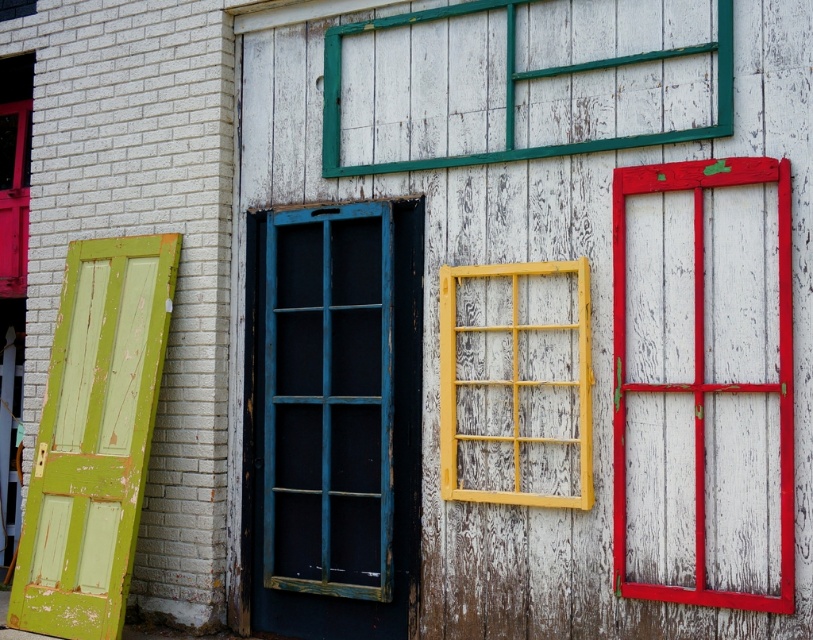
Question: Which is farther from the blue wooden window at center-left?

Choices:
 (A) yellow wood window at center
 (B) matte red door at left
 (C) green matte door at left
 (D) smooth painted wood window at right

Answer: (B)

Question: Observing the image, what is the correct spatial positioning of green matte door at left in reference to yellow wood window at center?

Choices:
 (A) above
 (B) below

Answer: (B)

Question: Which point is farther to the camera?

Choices:
 (A) (300, 211)
 (B) (22, 125)
 (C) (624, 532)

Answer: (B)

Question: Does green matte door at left appear over matte red door at left?

Choices:
 (A) no
 (B) yes

Answer: (A)

Question: Can you confirm if yellow wood window at center is positioned above matte red door at left?

Choices:
 (A) no
 (B) yes

Answer: (A)

Question: Based on their relative distances, which object is farther from the matte red door at left?

Choices:
 (A) yellow wood window at center
 (B) blue wooden window at center-left
 (C) green matte door at left

Answer: (A)